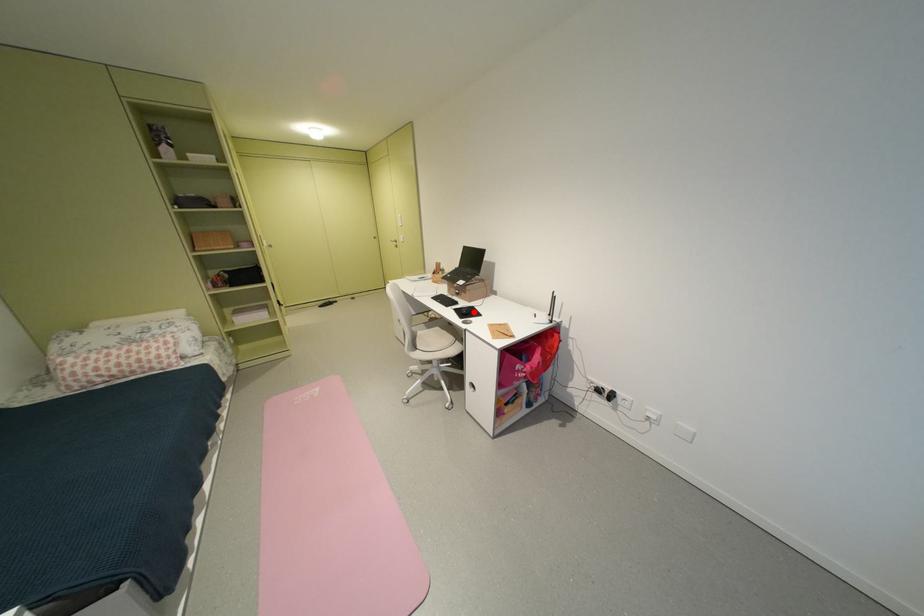
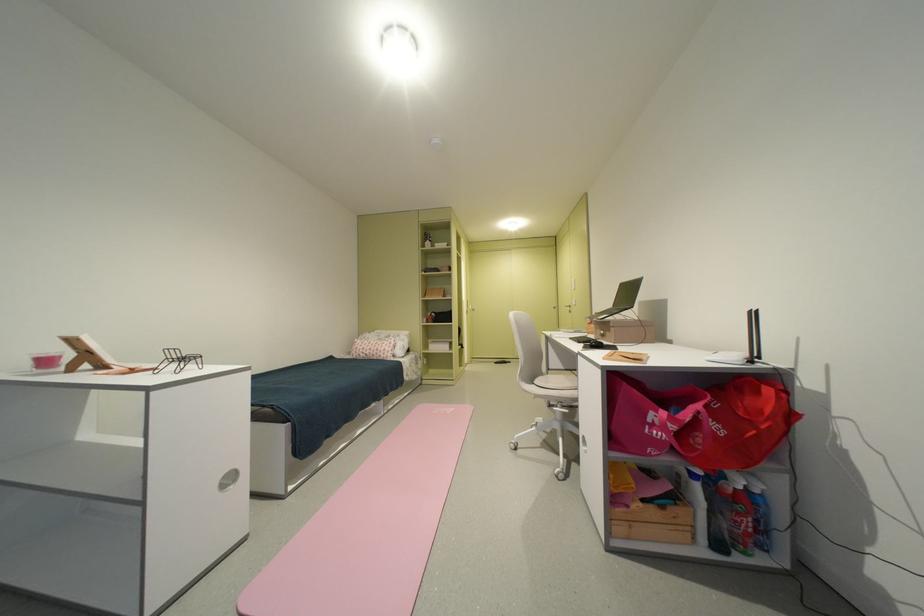
Where in the second image is the point corresponding to the highlighted location from the first image?

(602, 342)